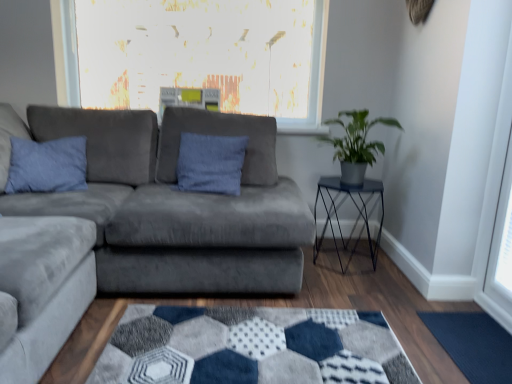
Measure the distance between blue suede pillow at left and camera.

The distance of blue suede pillow at left from camera is 7.22 feet.

The image size is (512, 384). What do you see at coordinates (47, 165) in the screenshot?
I see `blue suede pillow at left` at bounding box center [47, 165].

What do you see at coordinates (473, 344) in the screenshot? I see `dark blue textured mat at lower right` at bounding box center [473, 344].

The image size is (512, 384). Describe the element at coordinates (356, 219) in the screenshot. I see `metallic black table at right` at that location.

What do you see at coordinates (176, 205) in the screenshot?
I see `suede gray couch at center` at bounding box center [176, 205].

Where is `blue suede pillow at left`? blue suede pillow at left is located at coordinates (47, 165).

In the image, is green matte plant at right on the left side or the right side of dark blue textured mat at lower right?

From the image, it's evident that green matte plant at right is to the left of dark blue textured mat at lower right.

Based on their sizes in the image, would you say green matte plant at right is bigger or smaller than dark blue textured mat at lower right?

green matte plant at right is bigger than dark blue textured mat at lower right.

Based on the photo, considering the relative sizes of green matte plant at right and dark blue textured mat at lower right in the image provided, is green matte plant at right thinner than dark blue textured mat at lower right?

No.

Is green matte plant at right shorter than dark blue textured mat at lower right?

In fact, green matte plant at right may be taller than dark blue textured mat at lower right.

Is dark blue textured mat at lower right closer to the viewer compared to metallic black table at right?

Yes.

Does dark blue textured mat at lower right have a greater height compared to metallic black table at right?

No.

Is dark blue textured mat at lower right beside metallic black table at right?

No, dark blue textured mat at lower right is not with metallic black table at right.

Does dark blue textured mat at lower right have a greater width compared to metallic black table at right?

No.

Can you tell me how much suede gray couch at center and dark blue textured mat at lower right differ in facing direction?

The angular difference between suede gray couch at center and dark blue textured mat at lower right is 1.26 degrees.

Between suede gray couch at center and dark blue textured mat at lower right, which one has smaller size?

dark blue textured mat at lower right is smaller.

From a real-world perspective, is suede gray couch at center on top of dark blue textured mat at lower right?

Correct, in the physical world, suede gray couch at center is higher than dark blue textured mat at lower right.

From the image's perspective, does suede gray couch at center appear lower than dark blue textured mat at lower right?

No, from the image's perspective, suede gray couch at center is not below dark blue textured mat at lower right.

Can you confirm if blue suede pillow at left is wider than green matte plant at right?

Incorrect, the width of blue suede pillow at left does not surpass that of green matte plant at right.

Can you confirm if blue suede pillow at left is shorter than green matte plant at right?

Incorrect, the height of blue suede pillow at left does not fall short of that of green matte plant at right.

Which is more to the right, blue suede pillow at left or green matte plant at right?

green matte plant at right is more to the right.

From a real-world perspective, which is physically above, blue suede pillow at left or green matte plant at right?

green matte plant at right.

From a real-world perspective, who is located lower, green matte plant at right or blue suede pillow at left?

blue suede pillow at left, from a real-world perspective.

From their relative heights in the image, would you say green matte plant at right is taller or shorter than blue suede pillow at left?

Clearly, green matte plant at right is shorter compared to blue suede pillow at left.

Considering the points (364, 169) and (16, 175), which point is in front, point (364, 169) or point (16, 175)?

The point (16, 175) is closer.

Is metallic black table at right aimed at blue suede pillow at left?

No, metallic black table at right is not facing towards blue suede pillow at left.

The height and width of the screenshot is (384, 512). I want to click on table behind the blue suede pillow at left, so click(x=356, y=219).

Is point (336, 247) closer to camera compared to point (67, 172)?

No, it is not.

From the image's perspective, between metallic black table at right and blue suede pillow at left, which one is located above?

From the image's view, blue suede pillow at left is above.

Based on the photo, is blue suede pillow at left placed right next to suede gray couch at center?

No, blue suede pillow at left is not beside suede gray couch at center.

What's the angular difference between blue suede pillow at left and suede gray couch at center's facing directions?

The angle between the facing direction of blue suede pillow at left and the facing direction of suede gray couch at center is 71.8 degrees.

Is blue suede pillow at left not within suede gray couch at center?

No, blue suede pillow at left is inside suede gray couch at center's boundary.

From the image's perspective, which one is positioned lower, blue suede pillow at left or suede gray couch at center?

suede gray couch at center appears lower in the image.

Where is `houseplant on the left of dark blue textured mat at lower right`? The width and height of the screenshot is (512, 384). houseplant on the left of dark blue textured mat at lower right is located at coordinates (356, 145).

The height and width of the screenshot is (384, 512). What are the coordinates of `mat that appears in front of the metallic black table at right` in the screenshot? It's located at (473, 344).

Estimate the real-world distances between objects in this image. Which object is closer to metallic black table at right, dark blue textured mat at lower right or suede gray couch at center?

dark blue textured mat at lower right.

Based on their spatial positions, is dark blue textured mat at lower right or suede gray couch at center closer to blue suede pillow at left?

suede gray couch at center.

Which object lies nearer to the anchor point suede gray couch at center, blue suede pillow at left or dark blue textured mat at lower right?

blue suede pillow at left.

When comparing their distances from metallic black table at right, does suede gray couch at center or green matte plant at right seem further?

The object further to metallic black table at right is suede gray couch at center.

Estimate the real-world distances between objects in this image. Which object is further from suede gray couch at center, green matte plant at right or metallic black table at right?

green matte plant at right.

Which object lies nearer to the anchor point blue suede pillow at left, green matte plant at right or suede gray couch at center?

suede gray couch at center.

Considering their positions, is blue suede pillow at left positioned further to green matte plant at right than suede gray couch at center?

Based on the image, blue suede pillow at left appears to be further to green matte plant at right.

When comparing their distances from suede gray couch at center, does green matte plant at right or dark blue textured mat at lower right seem further?

Among the two, dark blue textured mat at lower right is located further to suede gray couch at center.

At what (x,y) coordinates should I click in order to perform the action: click on houseplant situated between suede gray couch at center and dark blue textured mat at lower right from left to right. Please return your answer as a coordinate pair (x, y). This screenshot has width=512, height=384. Looking at the image, I should click on tap(356, 145).

Identify the location of table between green matte plant at right and dark blue textured mat at lower right in the up-down direction. (356, 219).

Locate an element on the screen. The height and width of the screenshot is (384, 512). table situated between suede gray couch at center and green matte plant at right from left to right is located at coordinates (356, 219).

I want to click on houseplant situated between blue suede pillow at left and dark blue textured mat at lower right from left to right, so click(x=356, y=145).